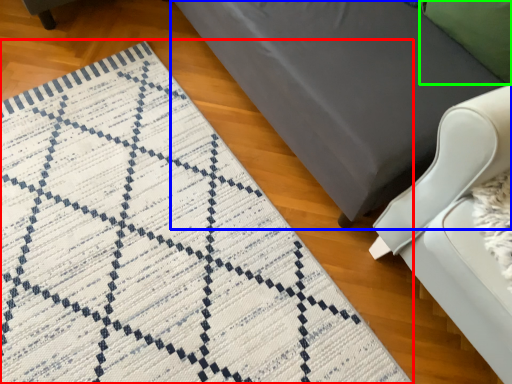
Question: Estimate the real-world distances between objects in this image. Which object is farther from mat (highlighted by a red box), furniture (highlighted by a blue box) or pillow (highlighted by a green box)?

Choices:
 (A) furniture
 (B) pillow

Answer: (B)